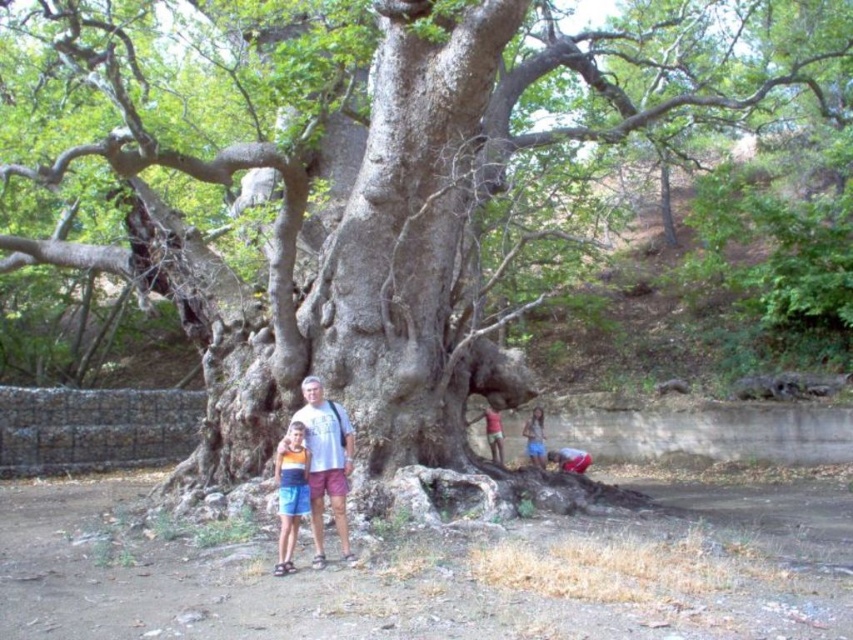
Question: Estimate the real-world distances between objects in this image. Which object is closer to the blue denim shorts at lower right?

Choices:
 (A) orange fabric shorts at lower left
 (B) white matte t-shirt at center

Answer: (B)

Question: Can you confirm if orange fabric shorts at lower left is positioned to the left of blue denim shorts at lower right?

Choices:
 (A) yes
 (B) no

Answer: (A)

Question: Estimate the real-world distances between objects in this image. Which object is farther from the blue denim shorts at lower right?

Choices:
 (A) orange fabric shorts at lower left
 (B) white matte t-shirt at center

Answer: (A)

Question: Which object is farther from the camera taking this photo?

Choices:
 (A) white matte t-shirt at center
 (B) blue denim shorts at lower right
 (C) orange fabric shorts at lower left

Answer: (B)

Question: Is orange fabric shorts at lower left bigger than blue denim shorts at lower right?

Choices:
 (A) no
 (B) yes

Answer: (A)

Question: Is white matte t-shirt at center wider than blue denim shorts at lower right?

Choices:
 (A) no
 (B) yes

Answer: (B)